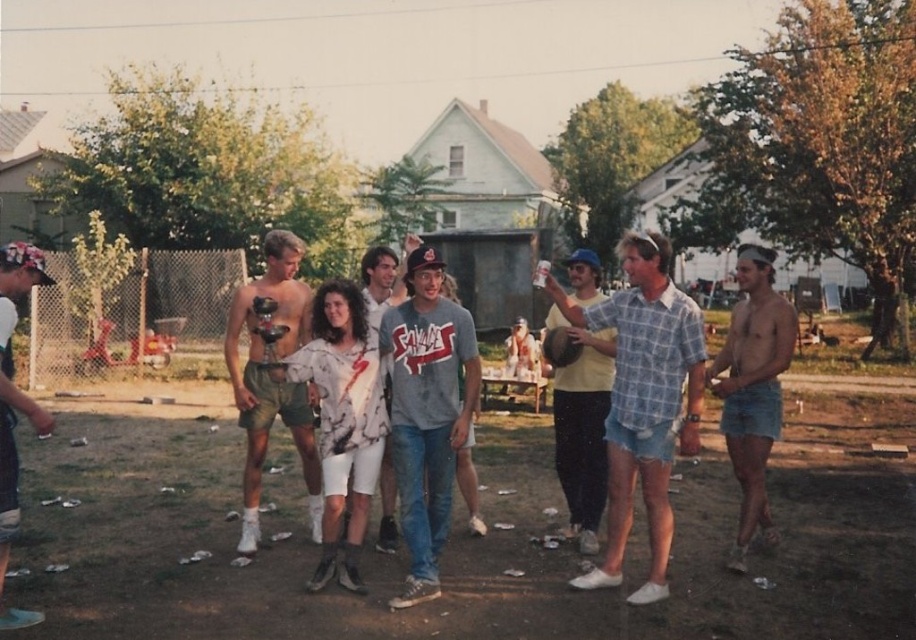
You are standing in the backyard party scene. You see a group of people at the center and a point marked at coordinates (751, 388). What is located at that point?

The point at coordinates (751, 388) indicates denim shorts at right.